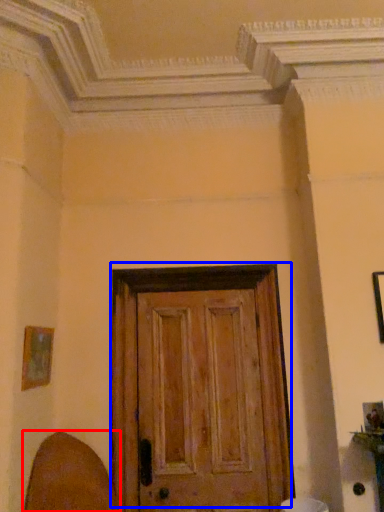
Question: Among these objects, which one is farthest to the camera, swivel chair (highlighted by a red box) or door (highlighted by a blue box)?

Choices:
 (A) swivel chair
 (B) door

Answer: (B)